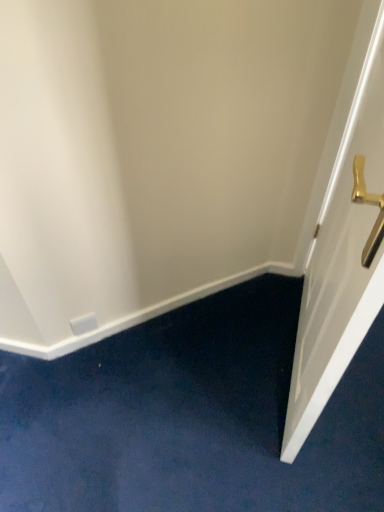
The image size is (384, 512). Describe the element at coordinates (341, 253) in the screenshot. I see `white glossy door at right` at that location.

Locate an element on the screen. white glossy door at right is located at coordinates (341, 253).

Identify the location of white glossy door at right. (341, 253).